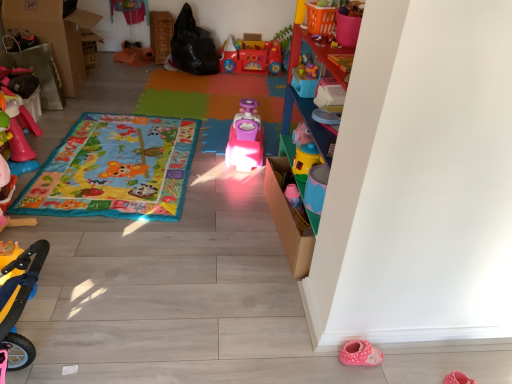
Question: Looking at their shapes, would you say yellow plastic scooter at lower left, placed as the 5th toy when sorted from right to left, is wider or thinner than rubberized pink toy at left, positioned as the 1th toy in left-to-right order?

Choices:
 (A) thin
 (B) wide

Answer: (A)

Question: Considering their positions, is yellow plastic scooter at lower left, arranged as the first toy when viewed from the front, located in front of or behind rubberized pink toy at left, which is counted as the 8th toy, starting from the right?

Choices:
 (A) behind
 (B) front

Answer: (B)

Question: Which object is the closest to the yellow plastic cup at upper right, the 2th toy in the right-to-left sequence?

Choices:
 (A) multicolored fabric play mat at center, which is counted as the second blanket, starting from the back
 (B) pink rubber shoe at upper right
 (C) matte pink car at center, arranged as the second blanket when viewed from the front
 (D) rubberized red toy car at center, which appears as the 8th toy when viewed from the front
 (E) rubberized pink toy at left, the 4th toy in the back-to-front sequence

Answer: (B)

Question: Which object is positioned closest to the yellow plastic scooter at lower left, the fourth toy positioned from the left?

Choices:
 (A) orange plastic basket at upper center, the 2th toy in the front-to-back sequence
 (B) pink rubber shoe at upper right
 (C) multicolored fabric play mat at center, the 1th blanket viewed from the front
 (D) matte pink car at center, the first blanket when ordered from back to front
 (E) cardboard box at left

Answer: (C)